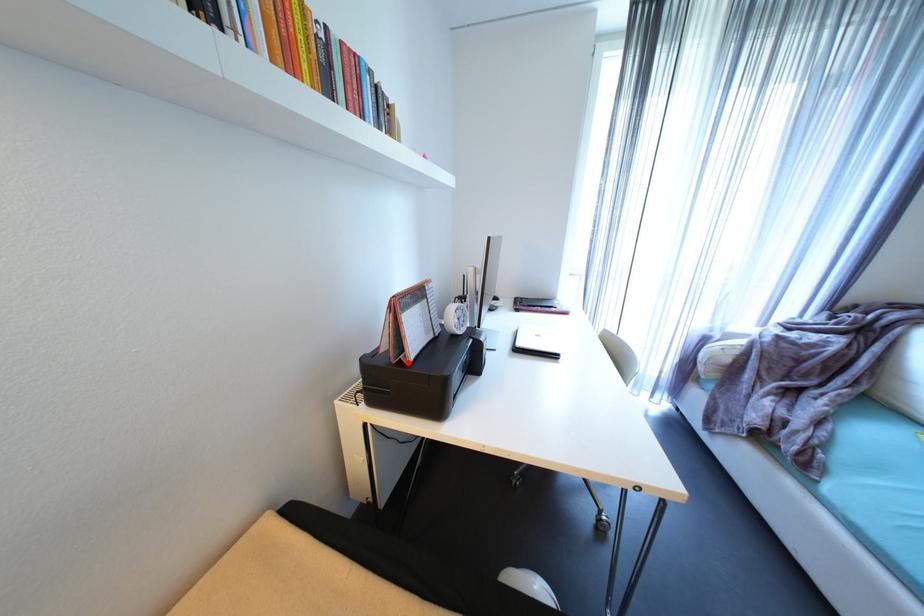
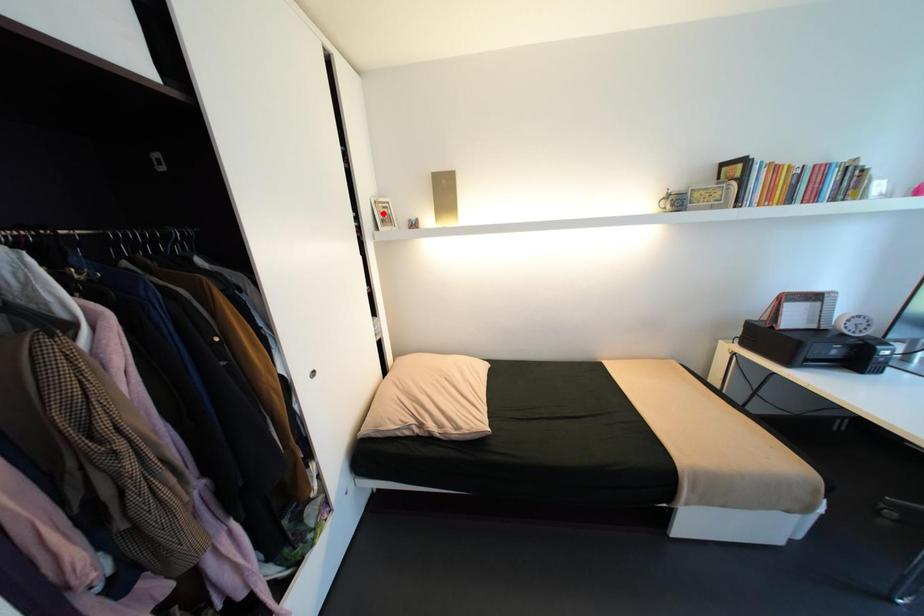
I am providing you with two images of the same scene from different viewpoints. A red point is marked on the first image and another point is marked on the second image. Does the point marked in image1 correspond to the same location as the one in image2?

No